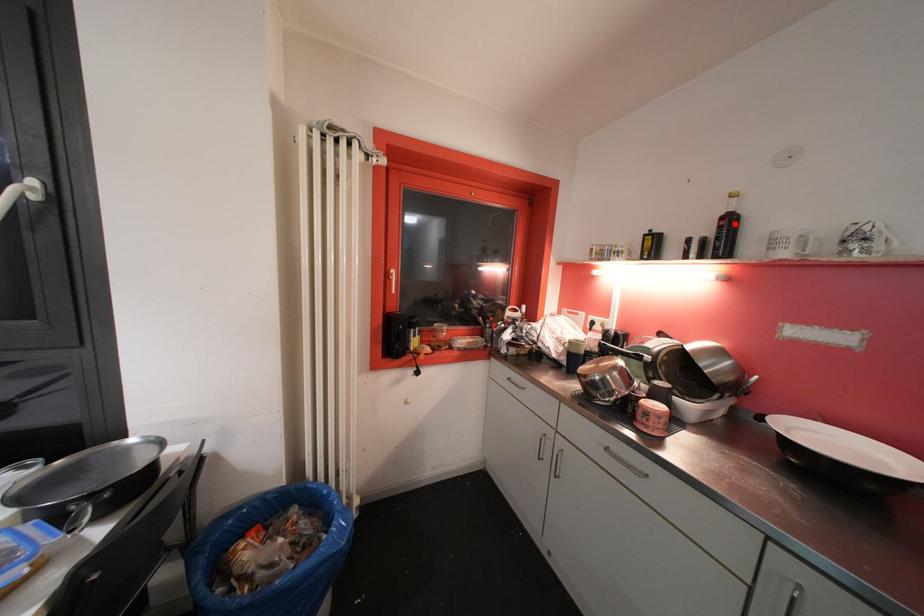
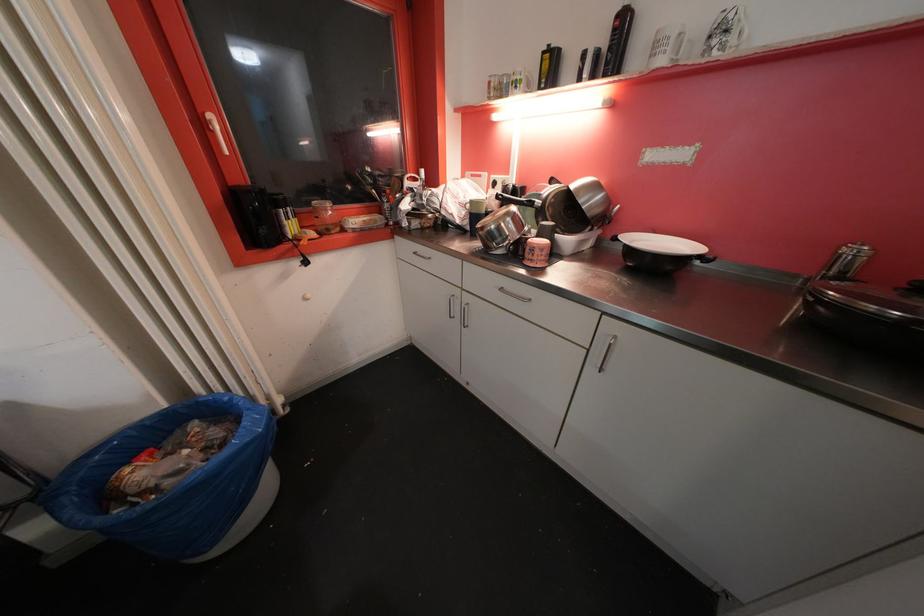
The point at the highlighted location is marked in the first image. Where is the corresponding point in the second image?

(628, 25)